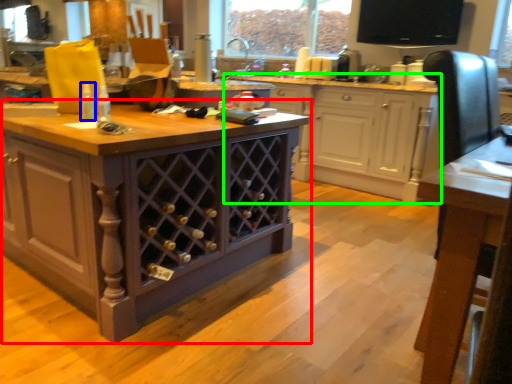
Question: Based on their relative distances, which object is farther from cabinetry (highlighted by a red box)? Choose from bottle (highlighted by a blue box) and cabinetry (highlighted by a green box).

Choices:
 (A) bottle
 (B) cabinetry

Answer: (B)